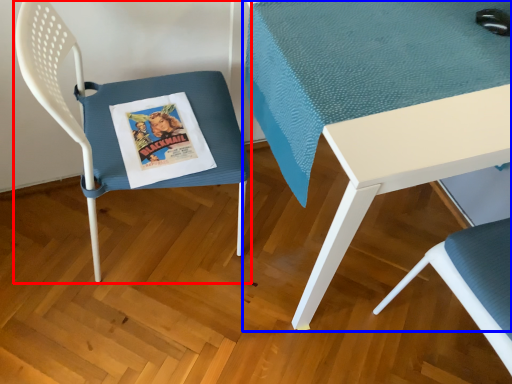
Question: Among these objects, which one is farthest to the camera, chair (highlighted by a red box) or table (highlighted by a blue box)?

Choices:
 (A) chair
 (B) table

Answer: (B)